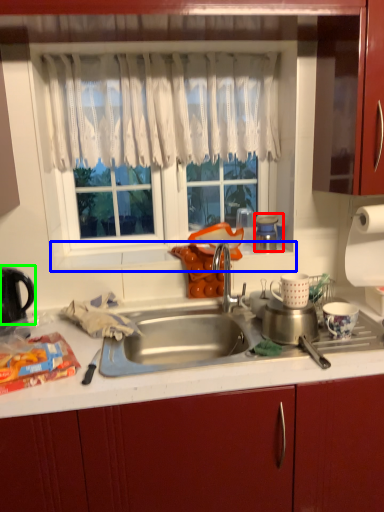
Question: Which is nearer to the appliance (highlighted by a red box)? window sill (highlighted by a blue box) or kitchen appliance (highlighted by a green box).

Choices:
 (A) window sill
 (B) kitchen appliance

Answer: (A)